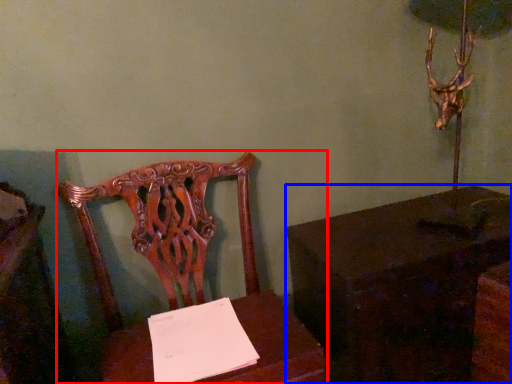
Question: Which object appears farthest to the camera in this image, chair (highlighted by a red box) or table (highlighted by a blue box)?

Choices:
 (A) chair
 (B) table

Answer: (B)